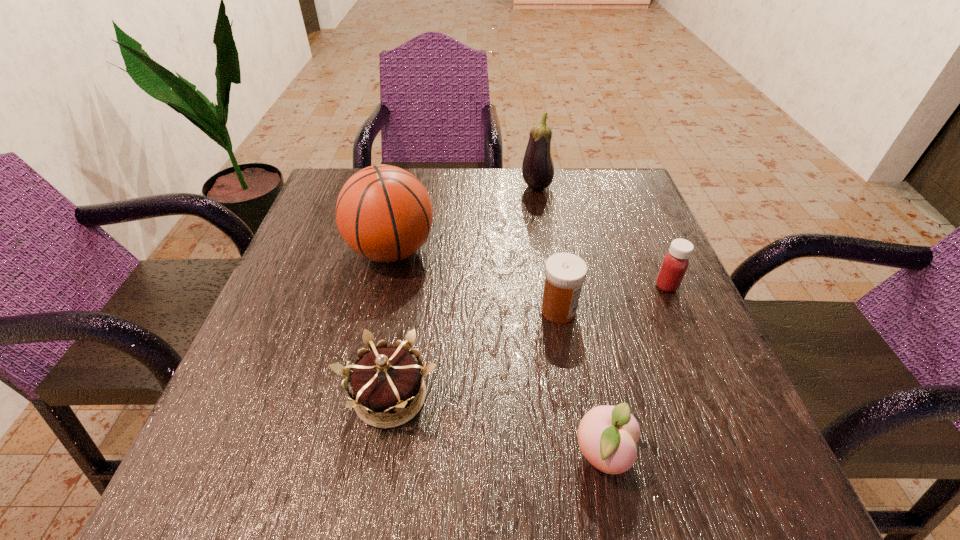
Find the location of `vacant space located on the back of the nearer medicine`. vacant space located on the back of the nearer medicine is located at coordinates (540, 202).

Locate an element on the screen. The height and width of the screenshot is (540, 960). vacant space located 0.230m on the front of the farther medicine is located at coordinates (715, 400).

Locate an element on the screen. free space located 0.070m on the right of the crown is located at coordinates (485, 396).

Identify the location of vacant space positioned 0.360m on the back of the peach. (564, 264).

This screenshot has height=540, width=960. Identify the location of object situated at the far edge. (537, 169).

Image resolution: width=960 pixels, height=540 pixels. Identify the location of crown that is at the near edge. (385, 380).

Find the location of `peach situated at the near edge`. peach situated at the near edge is located at coordinates point(607,435).

Find the location of a particular element. The width and height of the screenshot is (960, 540). object at the left edge is located at coordinates (384, 213).

Locate an element on the screen. object that is at the right edge is located at coordinates (675, 263).

This screenshot has height=540, width=960. In order to click on vacant space at the far edge of the desktop in this screenshot , I will do `click(476, 208)`.